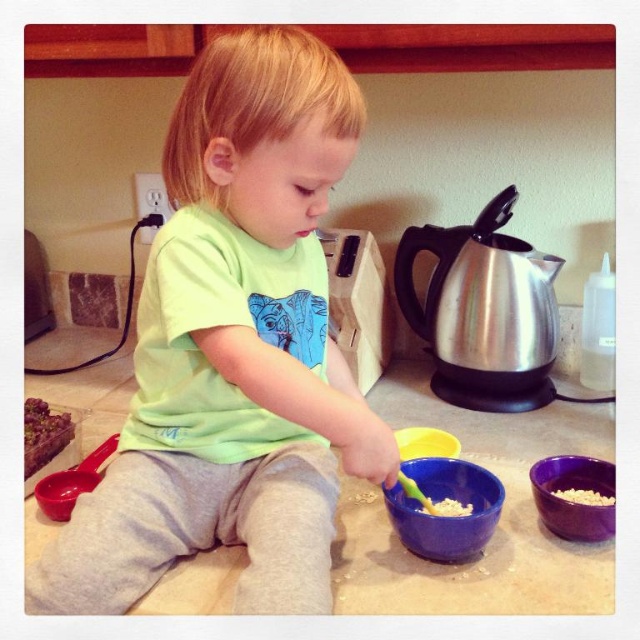
Is stainless steel kettle at right taller than yellow matte bowl at lower center?

Correct, stainless steel kettle at right is much taller as yellow matte bowl at lower center.

Is stainless steel kettle at right to the right of yellow matte bowl at lower center from the viewer's perspective?

Correct, you'll find stainless steel kettle at right to the right of yellow matte bowl at lower center.

Is point (464, 403) closer to viewer compared to point (401, 444)?

That is False.

This screenshot has height=640, width=640. I want to click on stainless steel kettle at right, so click(483, 310).

Which is above, green matte shirt at center or purple glossy bowl at lower right?

green matte shirt at center is higher up.

Image resolution: width=640 pixels, height=640 pixels. Describe the element at coordinates (234, 349) in the screenshot. I see `green matte shirt at center` at that location.

Which is behind, point (253, 317) or point (589, 460)?

The point (589, 460) is behind.

Image resolution: width=640 pixels, height=640 pixels. Find the location of `green matte shirt at center`. green matte shirt at center is located at coordinates (234, 349).

Which of these two, green matte shirt at center or smooth chocolate cake at lower left, stands shorter?

smooth chocolate cake at lower left

The width and height of the screenshot is (640, 640). What do you see at coordinates (234, 349) in the screenshot? I see `green matte shirt at center` at bounding box center [234, 349].

Where is `green matte shirt at center`? This screenshot has height=640, width=640. green matte shirt at center is located at coordinates (234, 349).